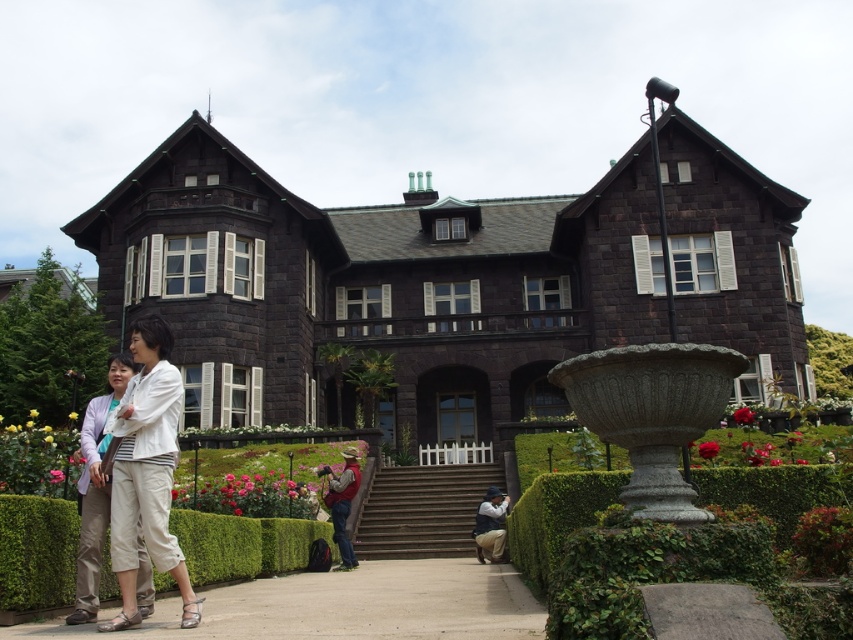
Does point (369, 552) lie behind point (347, 460)?

No, it is not.

Can you confirm if smooth concrete stairs at center is positioned to the right of rustic brown vest at center?

Result: Correct, you'll find smooth concrete stairs at center to the right of rustic brown vest at center.

Does point (405, 548) come behind point (329, 493)?

Yes.

Where is `smooth concrete stairs at center`? smooth concrete stairs at center is located at coordinates (422, 509).

Does white cotton pants at lower center appear on the right side of rustic brown vest at center?

In fact, white cotton pants at lower center is to the left of rustic brown vest at center.

Which of these two, white cotton pants at lower center or rustic brown vest at center, stands taller?

white cotton pants at lower center

Which is in front, point (165, 397) or point (341, 513)?

Point (165, 397) is in front.

Where is `white cotton pants at lower center`? This screenshot has width=853, height=640. white cotton pants at lower center is located at coordinates (146, 472).

Is point (383, 554) in front of point (492, 500)?

That is False.

Is point (364, 525) positioned behind point (473, 536)?

Yes, it is behind point (473, 536).

Describe the element at coordinates (422, 509) in the screenshot. I see `smooth concrete stairs at center` at that location.

Where is `smooth concrete stairs at center`? Image resolution: width=853 pixels, height=640 pixels. smooth concrete stairs at center is located at coordinates (422, 509).